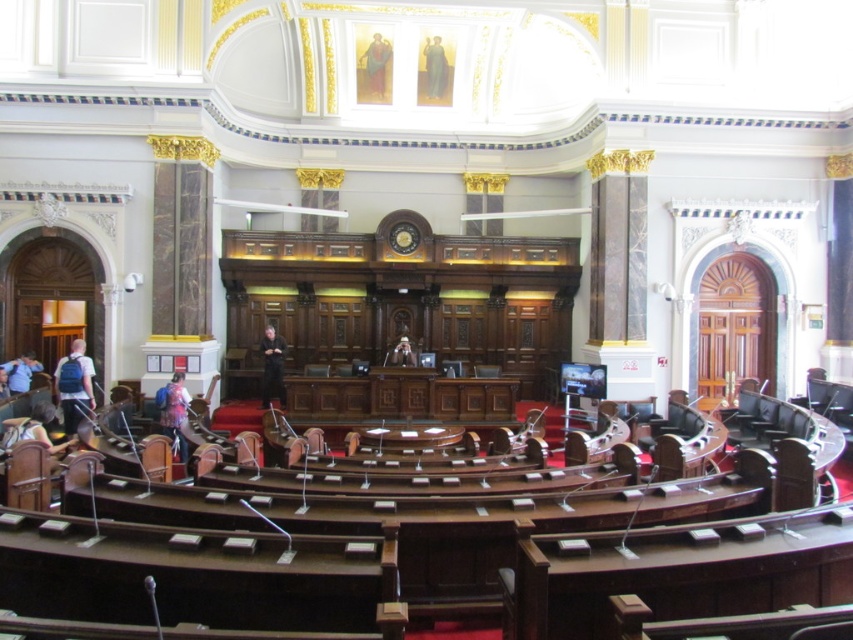
You are a visitor entering the assembly hall and need to retrieve your backpacks before leaving. You see the matte blue backpack at left and the blue fabric backpack at lower left. Which backpack is positioned higher up in the room?

The matte blue backpack at left is positioned higher up in the room as it is located above the blue fabric backpack at lower left.

You are standing in the assembly hall and see the point at coordinates (173, 412). Based on the scene description, what object is located at that point?

The point at coordinates (173, 412) is on the denim jacket at lower left.